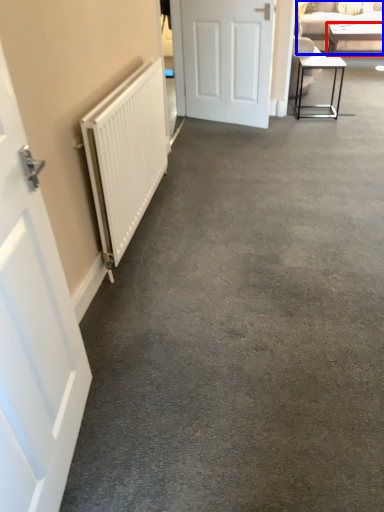
Question: Which of the following is the farthest to the observer, table (highlighted by a red box) or studio couch (highlighted by a blue box)?

Choices:
 (A) table
 (B) studio couch

Answer: (A)